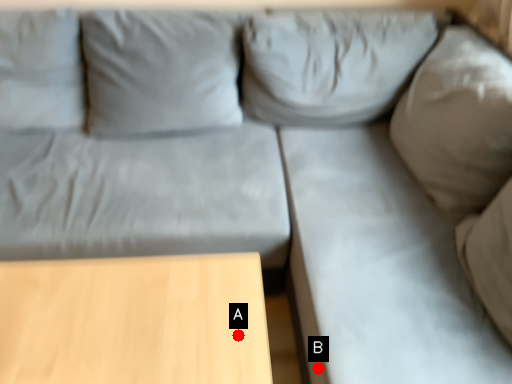
Question: Two points are circled on the image, labeled by A and B beside each circle. Which point is farther to the camera?

Choices:
 (A) A is further
 (B) B is further

Answer: (B)